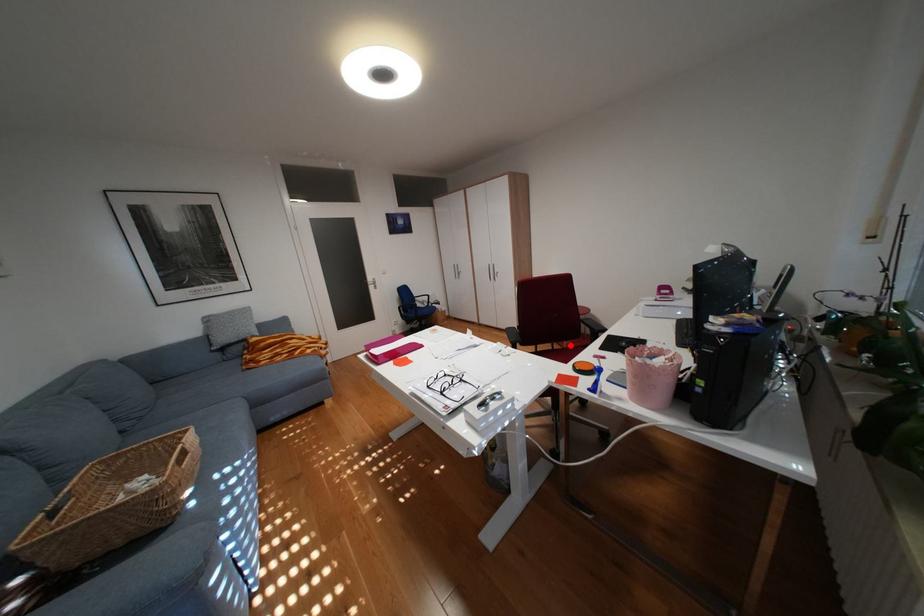
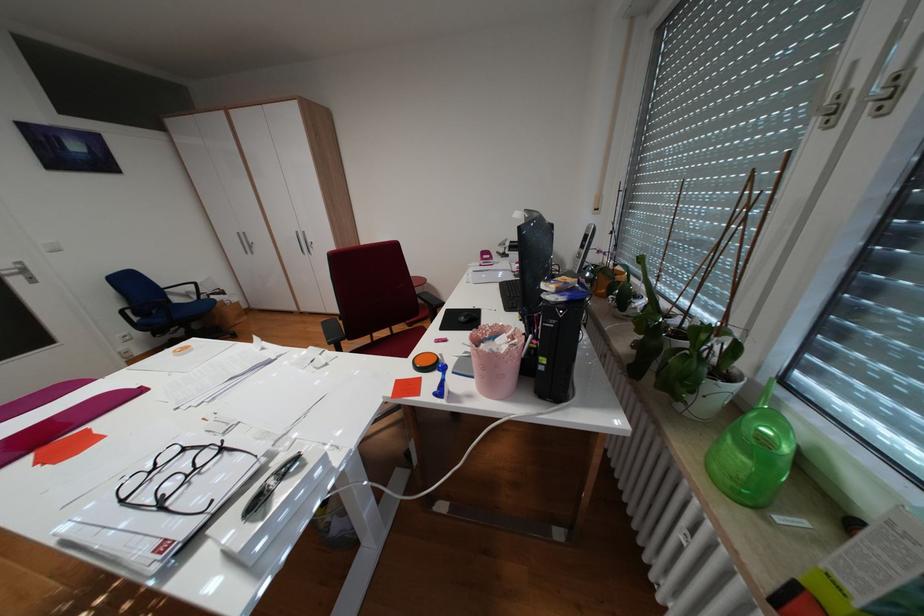
Locate, in the second image, the point that corresponds to the highlighted location in the first image.

(408, 329)